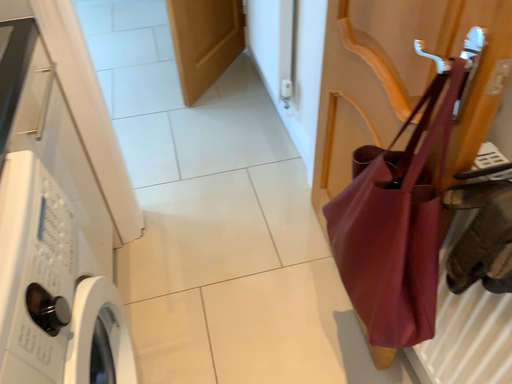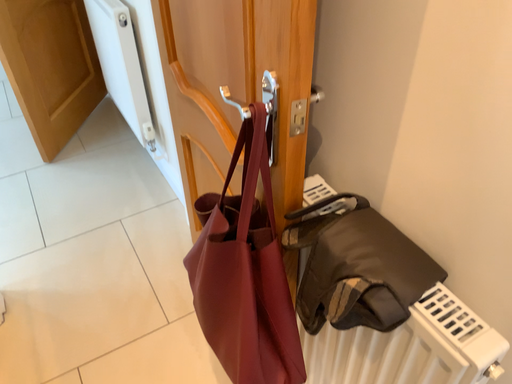
Question: Which way did the camera rotate in the video?

Choices:
 (A) rotated right
 (B) rotated left

Answer: (A)